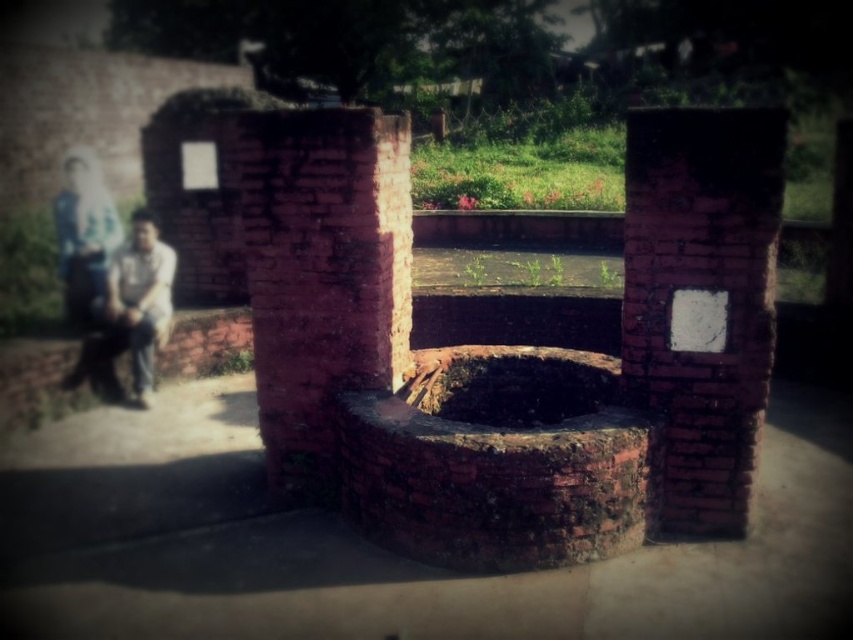
Looking at this image, can you confirm if brick wall at center is bigger than red brick pillar at center?

No, brick wall at center is not bigger than red brick pillar at center.

In order to click on brick wall at center in this screenshot , I will do `click(701, 300)`.

Consider the image. Between rusty brick fire pit at center and brick wall at center, which one appears on the right side from the viewer's perspective?

brick wall at center

Identify the location of rusty brick fire pit at center. (498, 460).

This screenshot has height=640, width=853. I want to click on rusty brick fire pit at center, so pos(498,460).

Is rusty brick fire pit at center positioned before light brown leather jacket at left?

Yes, rusty brick fire pit at center is closer to the viewer.

Between point (573, 522) and point (163, 252), which one is positioned in front?

Point (573, 522) is in front.

What are the coordinates of `rusty brick fire pit at center` in the screenshot? It's located at (498, 460).